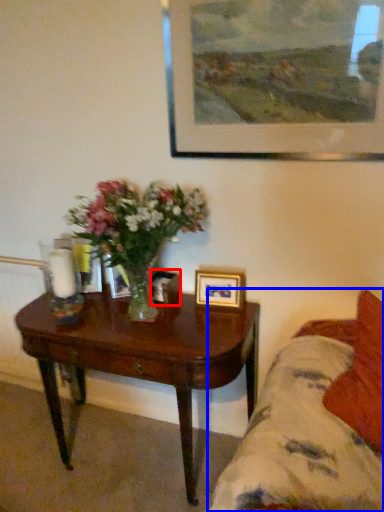
Question: Which object is closer to the camera taking this photo, picture frame (highlighted by a red box) or studio couch (highlighted by a blue box)?

Choices:
 (A) picture frame
 (B) studio couch

Answer: (B)